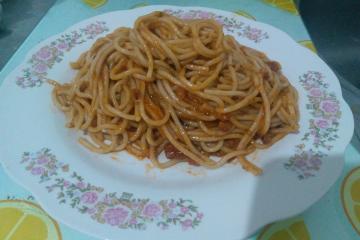
Locate an element on the screen. The image size is (360, 240). floral pattern on plate is located at coordinates (131, 202).